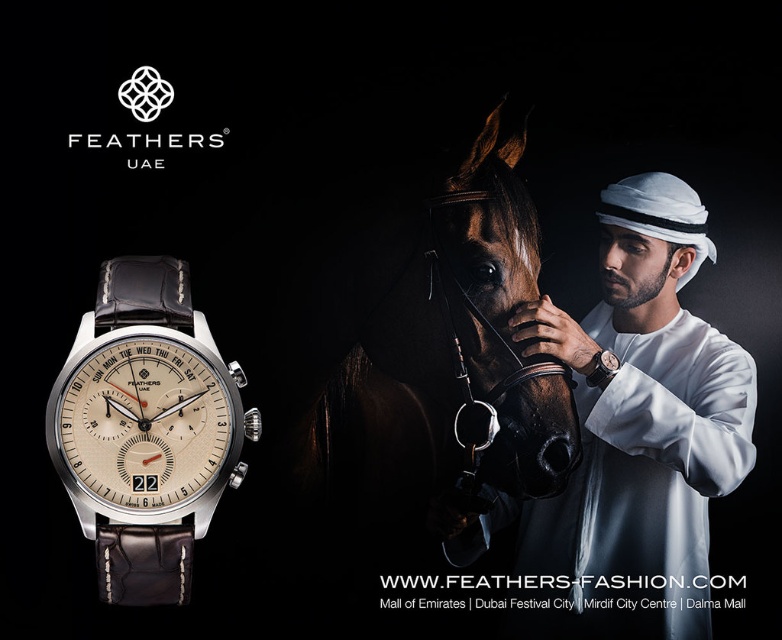
What do you see at coordinates (445, 364) in the screenshot? I see `brown leather horse at center` at bounding box center [445, 364].

Find the location of a particular element. Image resolution: width=782 pixels, height=640 pixels. brown leather horse at center is located at coordinates (445, 364).

Can you confirm if white leather watch at center is bigger than satin brown leather watch at center?

Correct, white leather watch at center is larger in size than satin brown leather watch at center.

Can you confirm if white leather watch at center is wider than satin brown leather watch at center?

Indeed, white leather watch at center has a greater width compared to satin brown leather watch at center.

In order to click on white leather watch at center in this screenshot , I will do `click(641, 426)`.

How distant is satin brown leather watch at center from satin silver watch at center?

The distance of satin brown leather watch at center from satin silver watch at center is 35.32 inches.

From the picture: Which is more to the right, satin brown leather watch at center or satin silver watch at center?

Positioned to the right is satin silver watch at center.

Who is more forward, (103, 298) or (598, 353)?

Positioned in front is point (103, 298).

Where is `satin brown leather watch at center`? This screenshot has height=640, width=782. satin brown leather watch at center is located at coordinates (146, 429).